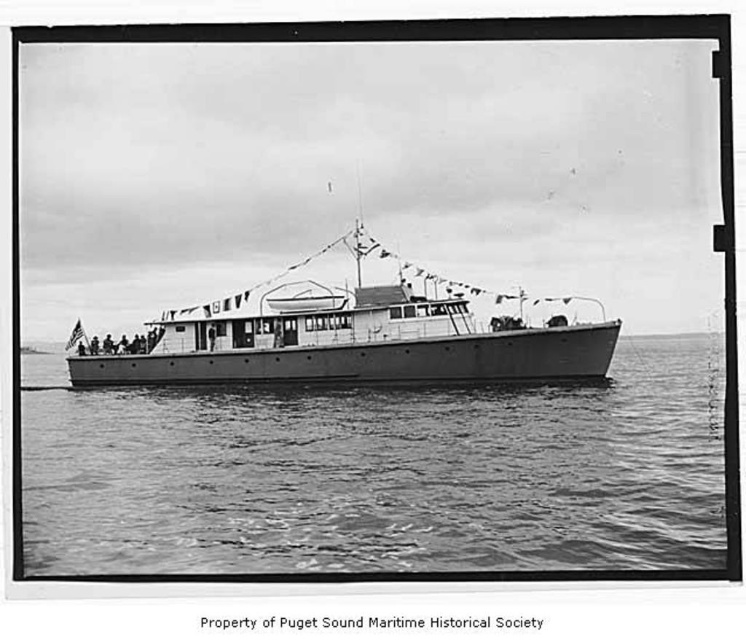
Does smooth water at center have a lesser height compared to smooth metal boat at center?

Yes, smooth water at center is shorter than smooth metal boat at center.

Between smooth water at center and smooth metal boat at center, which one has less height?

With less height is smooth water at center.

Locate an element on the screen. This screenshot has width=746, height=640. smooth water at center is located at coordinates (383, 474).